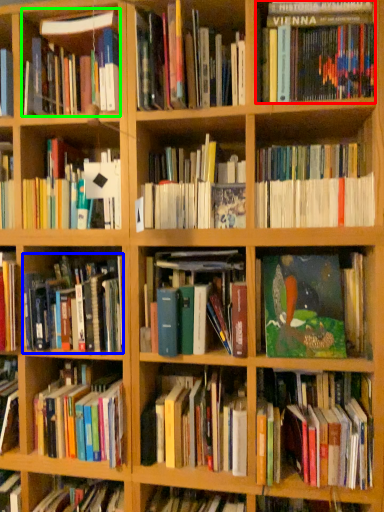
Question: Based on their relative distances, which object is nearer to book (highlighted by a red box)? Choose from book (highlighted by a blue box) and book (highlighted by a green box).

Choices:
 (A) book
 (B) book

Answer: (B)